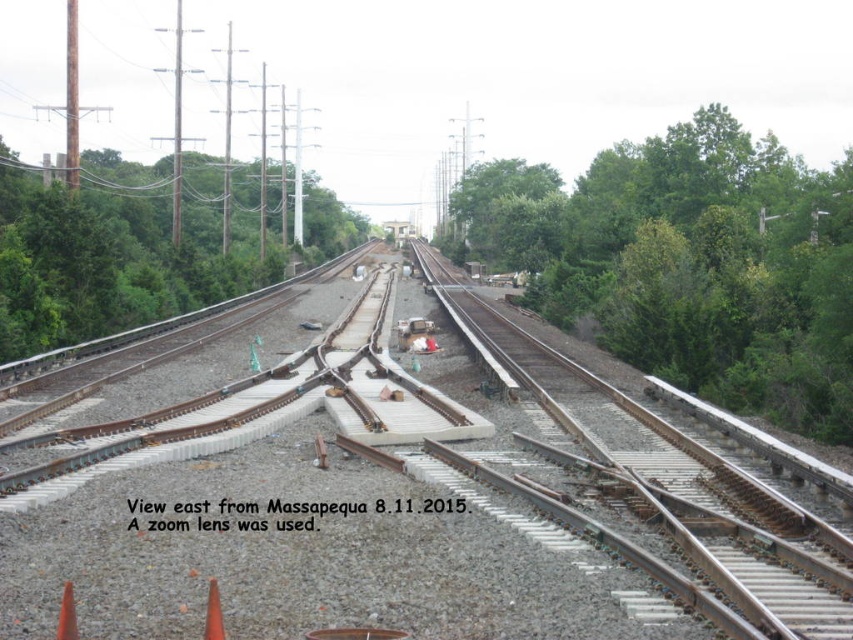
Question: Can you confirm if green leafy tree at center is wider than orange plastic cone at lower left?

Choices:
 (A) yes
 (B) no

Answer: (A)

Question: Does orange plastic cone at lower left have a greater width compared to orange matte cone at lower left?

Choices:
 (A) yes
 (B) no

Answer: (B)

Question: Is orange plastic cone at lower left to the left of orange matte cone at lower left from the viewer's perspective?

Choices:
 (A) no
 (B) yes

Answer: (B)

Question: Which of the following is the farthest from the observer?

Choices:
 (A) orange plastic cone at lower left
 (B) rusty metal train track at center

Answer: (B)

Question: Which object appears closest to the camera in this image?

Choices:
 (A) green leafy tree at center
 (B) orange plastic cone at lower left
 (C) rusty metal train track at center

Answer: (B)

Question: Which of the following is the farthest from the observer?

Choices:
 (A) green leafy tree at left
 (B) orange matte cone at lower left

Answer: (A)